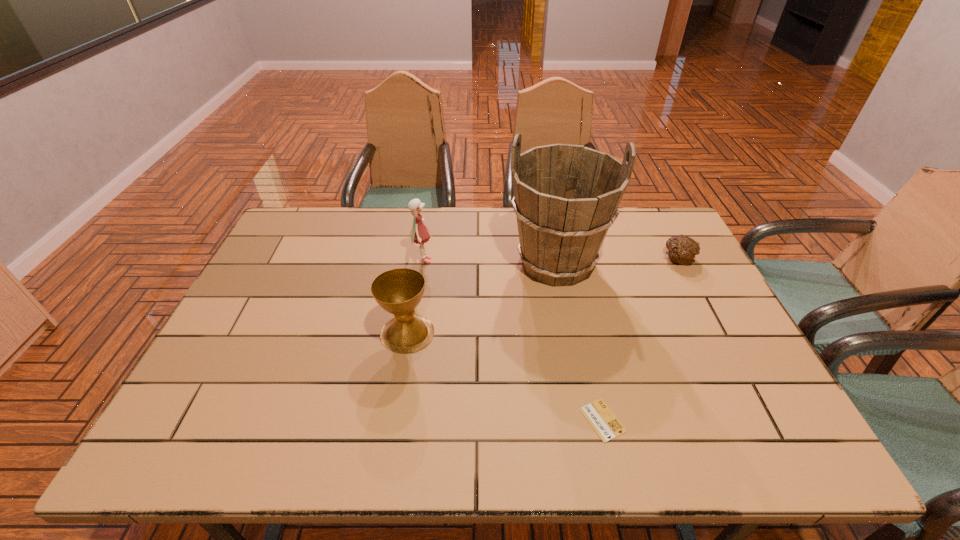
Locate an element on the screen. free region located on the front of the third tallest object is located at coordinates (391, 439).

This screenshot has height=540, width=960. I want to click on blank area located 0.080m on the front of the second shortest object, so click(693, 287).

Find the location of `vacant space situated on the right of the identity card`. vacant space situated on the right of the identity card is located at coordinates (776, 420).

Find the location of a particular element. The image size is (960, 540). bucket at the far edge is located at coordinates (566, 197).

This screenshot has height=540, width=960. Find the location of `doll that is positioned at the far edge`. doll that is positioned at the far edge is located at coordinates (419, 234).

The height and width of the screenshot is (540, 960). What are the coordinates of `muffin at the far edge` in the screenshot? It's located at (681, 249).

Locate an element on the screen. The image size is (960, 540). object at the near edge is located at coordinates (606, 425).

Image resolution: width=960 pixels, height=540 pixels. What are the coordinates of `object that is at the right edge` in the screenshot? It's located at click(x=681, y=249).

You are a GUI agent. You are given a task and a screenshot of the screen. Output one action in this format:
    pyautogui.click(x=<x>, y=<y>)
    Task: Click on the object that is at the far right corner
    The width and height of the screenshot is (960, 540).
    Given the screenshot: What is the action you would take?
    pyautogui.click(x=681, y=249)

You are a GUI agent. You are given a task and a screenshot of the screen. Output one action in this format:
    pyautogui.click(x=<x>, y=<y>)
    Task: Click on the vacant space at the far edge
    
    Given the screenshot: What is the action you would take?
    pyautogui.click(x=445, y=226)